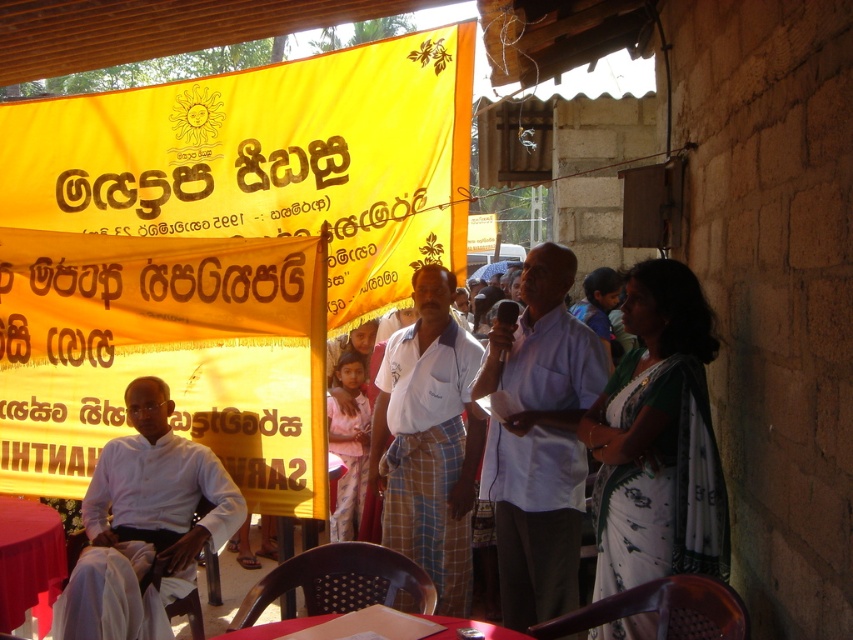
Consider the image. Between white matte shirt at center and smooth red table at lower left, which one is positioned higher?

white matte shirt at center

Does point (549, 536) come farther from viewer compared to point (28, 566)?

No.

Locate an element on the screen. The width and height of the screenshot is (853, 640). white matte shirt at center is located at coordinates tap(538, 440).

Locate an element on the screen. This screenshot has height=640, width=853. white matte shirt at center is located at coordinates (538, 440).

Does point (285, 294) come in front of point (161, 595)?

No.

Does yellow fabric banner at upper left have a larger size compared to white cotton shirt at left?

Yes, yellow fabric banner at upper left is bigger than white cotton shirt at left.

Who is more forward, (138, 136) or (143, 566)?

Positioned in front is point (143, 566).

The width and height of the screenshot is (853, 640). Identify the location of yellow fabric banner at upper left. (267, 161).

Image resolution: width=853 pixels, height=640 pixels. I want to click on white matte shirt at center, so click(x=538, y=440).

Who is shorter, white matte shirt at center or white woven shirt at center?

white matte shirt at center is shorter.

Identify the location of white matte shirt at center. The width and height of the screenshot is (853, 640). (538, 440).